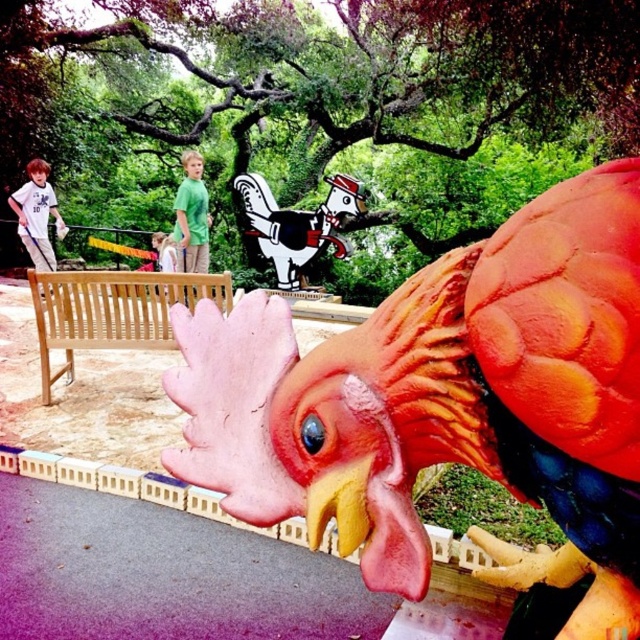
Who is positioned more to the right, cartoon chicken at center or matte white shirt at left?

From the viewer's perspective, cartoon chicken at center appears more on the right side.

Is point (250, 196) positioned behind point (56, 228)?

Yes, point (250, 196) is behind point (56, 228).

I want to click on cartoon chicken at center, so tap(298, 224).

In the scene shown: Who is higher up, light brown wooden bench at center or matte white shirt at left?

matte white shirt at left is higher up.

Can you confirm if light brown wooden bench at center is wider than matte white shirt at left?

Indeed, light brown wooden bench at center has a greater width compared to matte white shirt at left.

I want to click on light brown wooden bench at center, so click(113, 310).

Locate an element on the screen. light brown wooden bench at center is located at coordinates (113, 310).

Between light brown wooden bench at center and green matte shirt at center, which one is positioned lower?

light brown wooden bench at center

Measure the distance from light brown wooden bench at center to green matte shirt at center.

2.10 meters

Is point (77, 301) behind point (195, 224)?

No.

This screenshot has width=640, height=640. Find the location of `light brown wooden bench at center`. light brown wooden bench at center is located at coordinates click(113, 310).